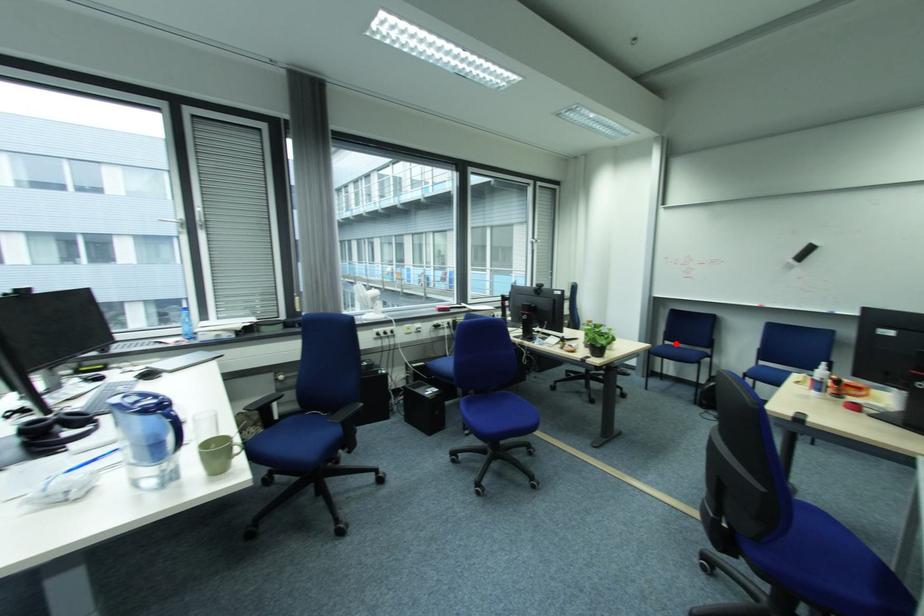
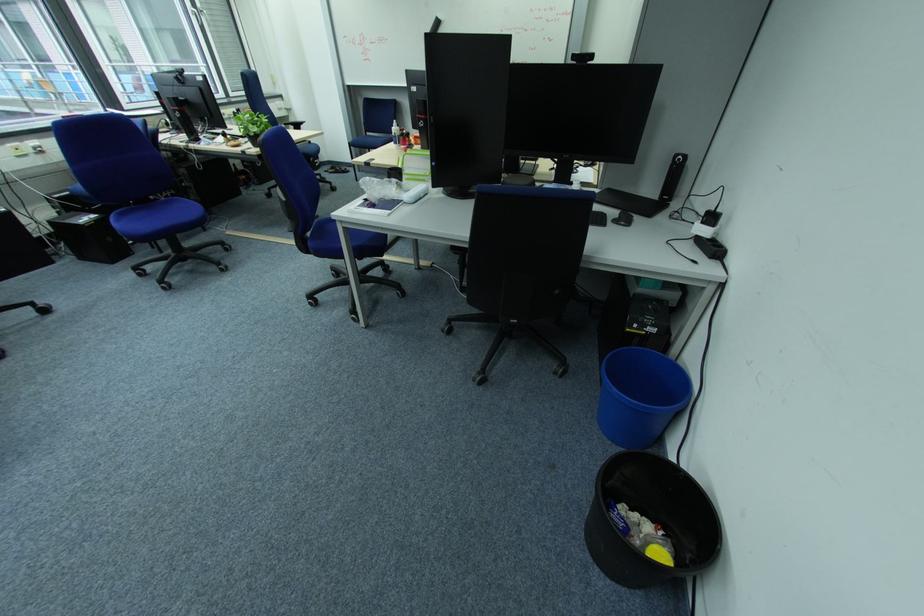
Question: I am providing you with two images of the same scene from different viewpoints. A red point is marked on the first image. Is the red point's position out of view in image 2?

Choices:
 (A) Yes
 (B) No

Answer: (B)